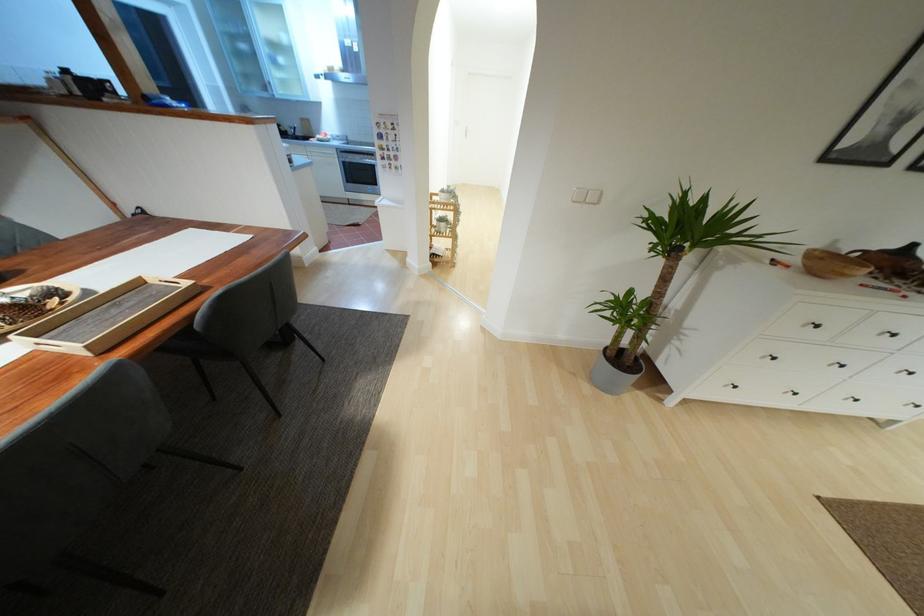
Find the location of a particular element. trash can lid is located at coordinates (388, 201).